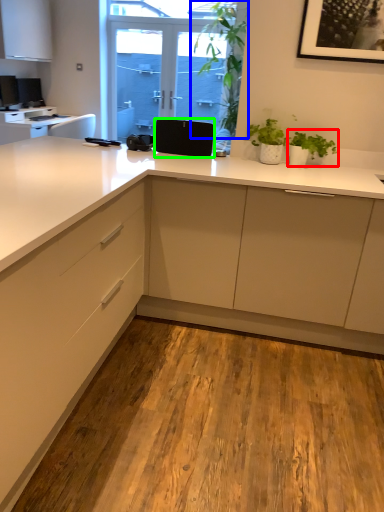
Question: Considering the real-world distances, which object is farthest from houseplant (highlighted by a red box)? plant (highlighted by a blue box) or speaker (highlighted by a green box)?

Choices:
 (A) plant
 (B) speaker

Answer: (A)